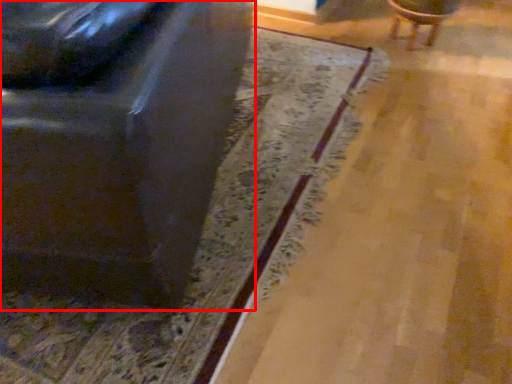
Question: Observing the image, what is the correct spatial positioning of chair (annotated by the red box) in reference to chair?

Choices:
 (A) left
 (B) right

Answer: (A)